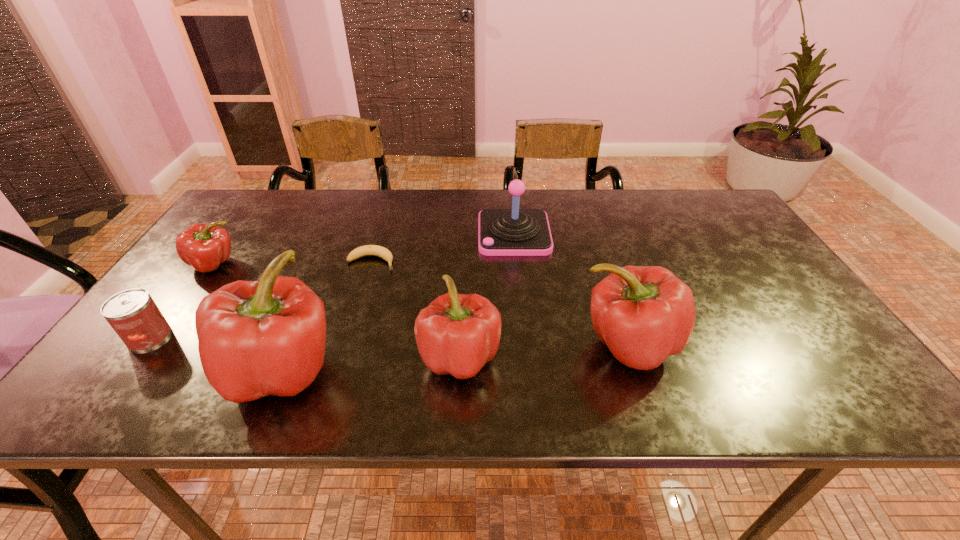
Find the location of a particular element. free space that satisfies the following two spatial constraints: 1. on the back side of the leftmost bell pepper; 2. on the right side of the rightmost object is located at coordinates (292, 345).

This screenshot has height=540, width=960. Find the location of `free space that satisfies the following two spatial constraints: 1. on the front side of the rightmost object; 2. on the left side of the pepper`. free space that satisfies the following two spatial constraints: 1. on the front side of the rightmost object; 2. on the left side of the pepper is located at coordinates (156, 345).